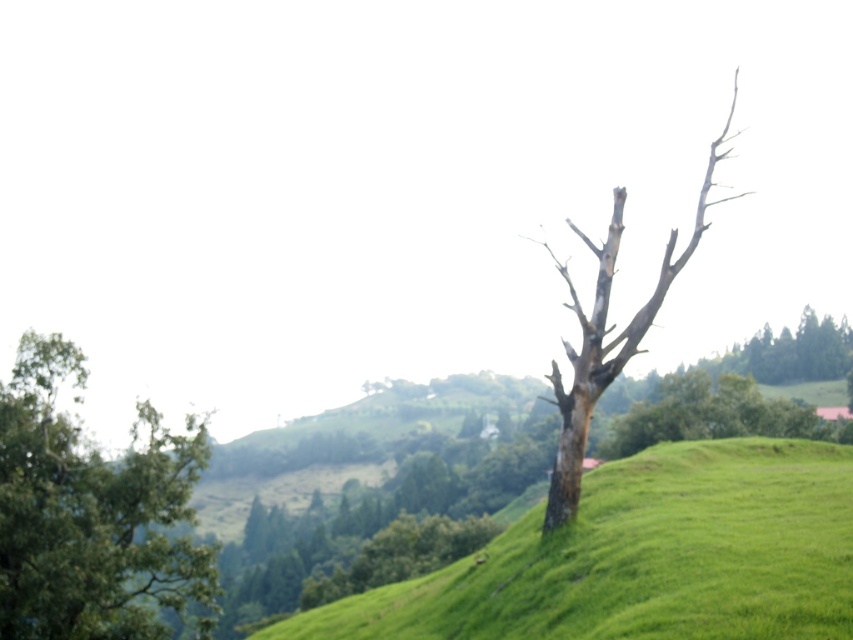
Question: Is green leafy tree at left smaller than dead wood tree at right?

Choices:
 (A) no
 (B) yes

Answer: (B)

Question: Among these points, which one is nearest to the camera?

Choices:
 (A) (494, 556)
 (B) (190, 477)

Answer: (A)

Question: In this image, where is green leafy tree at left located relative to dead wood tree at right?

Choices:
 (A) right
 (B) left

Answer: (B)

Question: Which object is farther from the camera taking this photo?

Choices:
 (A) green leafy tree at left
 (B) green grassy hillside at center

Answer: (A)

Question: Is green grassy hillside at center below dead wood tree at right?

Choices:
 (A) yes
 (B) no

Answer: (A)

Question: Which point is farther to the camera?

Choices:
 (A) green leafy tree at left
 (B) green grassy hillside at center
 (C) dead wood tree at right

Answer: (C)